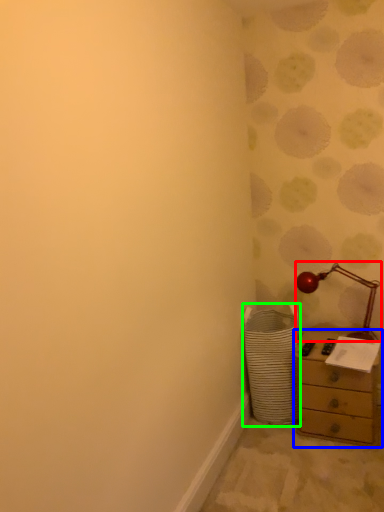
Question: Estimate the real-world distances between objects in this image. Which object is closer to table lamp (highlighted by a red box), chest of drawers (highlighted by a blue box) or laundry basket (highlighted by a green box)?

Choices:
 (A) chest of drawers
 (B) laundry basket

Answer: (A)